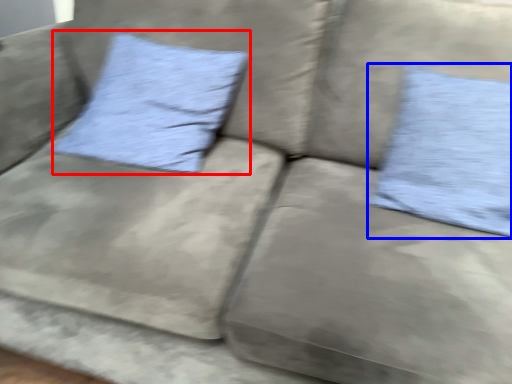
Question: Which object appears closest to the camera in this image, pillow (highlighted by a red box) or pillow (highlighted by a blue box)?

Choices:
 (A) pillow
 (B) pillow

Answer: (B)